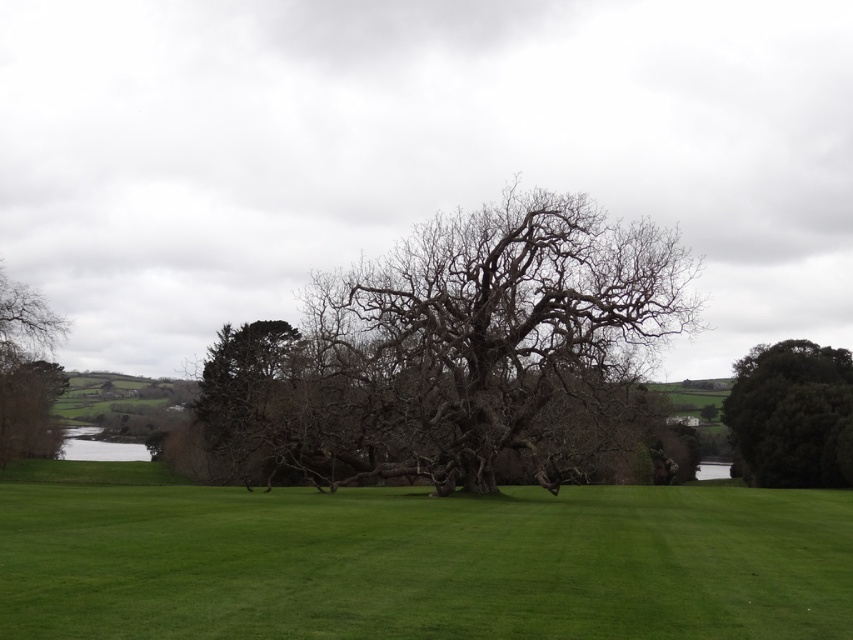
You are standing in the middle of the grassy field and see the bare branches at center and the bare branches at left. Which set of branches would cast a wider shadow on the ground?

The bare branches at center would cast a wider shadow on the ground because their width is larger than the bare branches at left.

You are standing at the center of the image and want to locate the bare branches at center. What are their coordinates?

The bare branches at center are located at coordinates point (447, 348).

You are standing in the landscape and want to touch the closest bare branches. Which one should you approach, the bare branches at center or the bare branches at left?

You should approach the bare branches at center because they are closer to the viewer than the bare branches at left.